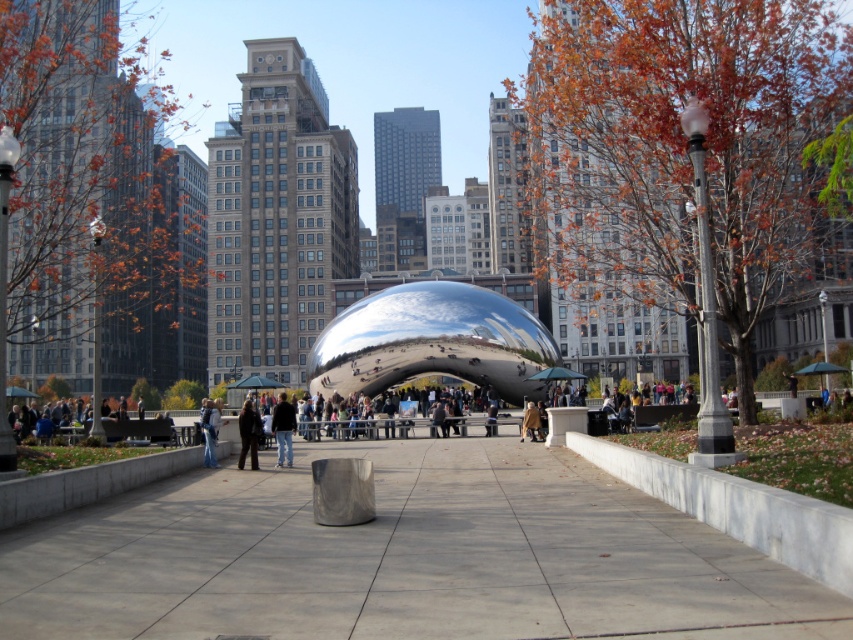
You are a photographer planning to capture a closeup shot of the gray concrete pavement at center and the black leather jacket at center in the park. Since you want both objects to appear similarly sized in the photo, which object should you move closer to the camera?

Since the gray concrete pavement at center is smaller in size compared to the black leather jacket at center, you should move the gray concrete pavement at center closer to the camera to make them appear similar in size in the photo.

You are standing at the entrance of the park and see the dark brown leather jacket at center. If you want to move towards the Cloud Gate sculpture, which is located north of your current position, should you walk towards or away from the jacket?

Since the dark brown leather jacket at center is located at point (248,435), and the Cloud Gate sculpture is north of your current position, you should walk towards the jacket to reach the sculpture.